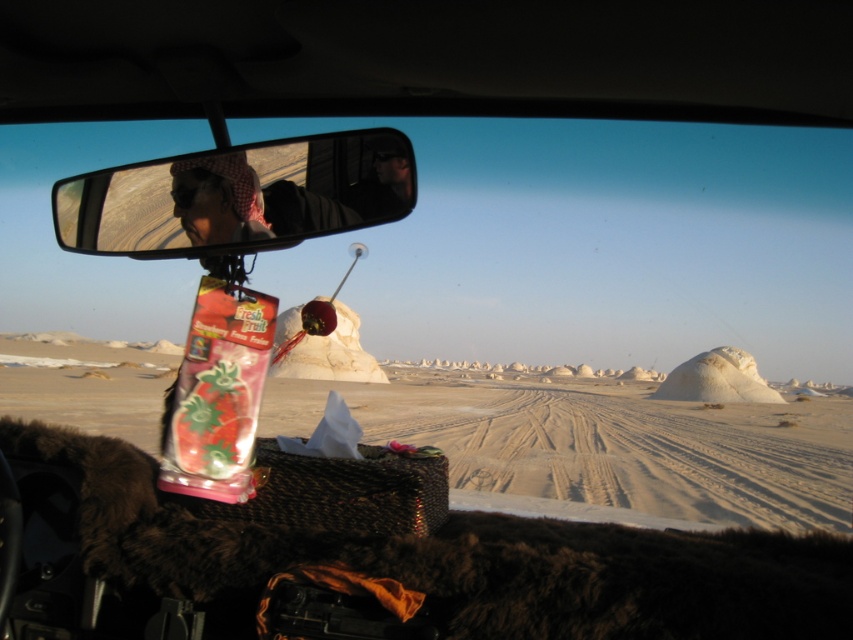
Who is shorter, clear plastic mirror at upper center or matte black headscarf at upper center?

Standing shorter between the two is matte black headscarf at upper center.

Which is below, clear plastic mirror at upper center or matte black headscarf at upper center?

matte black headscarf at upper center

Is point (289, 216) in front of point (212, 156)?

Yes, point (289, 216) is in front of point (212, 156).

Identify the location of clear plastic mirror at upper center. (238, 196).

Does white sandy desert at center have a lesser height compared to clear plastic mirror at upper center?

In fact, white sandy desert at center may be taller than clear plastic mirror at upper center.

Looking at this image, is white sandy desert at center bigger than clear plastic mirror at upper center?

Indeed, white sandy desert at center has a larger size compared to clear plastic mirror at upper center.

Is point (604, 424) closer to viewer compared to point (225, 202)?

No, it is behind (225, 202).

Locate an element on the screen. The width and height of the screenshot is (853, 640). white sandy desert at center is located at coordinates (605, 444).

Is point (126, 422) more distant than point (235, 164)?

Yes, point (126, 422) is farther from viewer.

Which is below, white sandy desert at center or matte black headscarf at upper center?

Positioned lower is white sandy desert at center.

Which is behind, point (300, 394) or point (169, 168)?

The point (300, 394) is more distant.

Where is `white sandy desert at center`? white sandy desert at center is located at coordinates (605, 444).